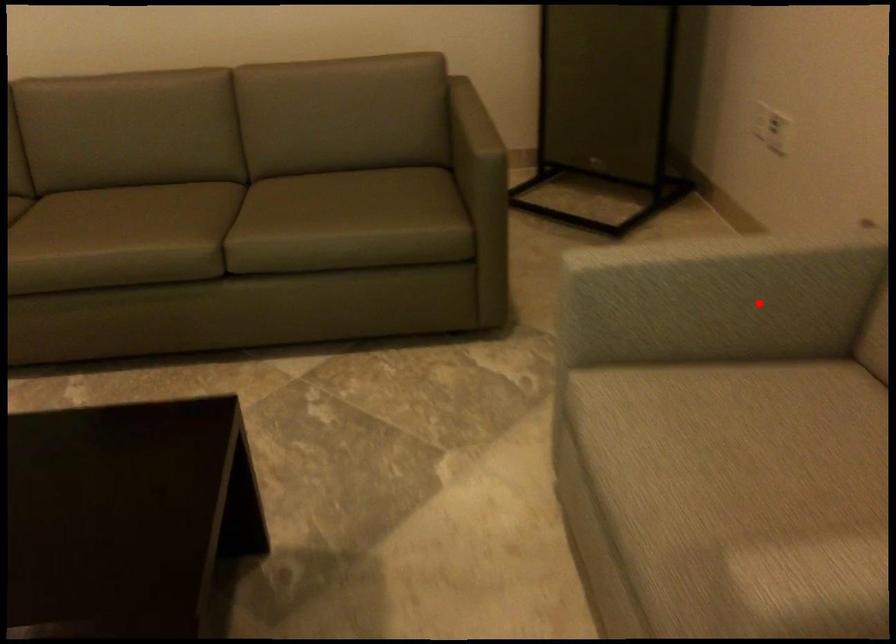
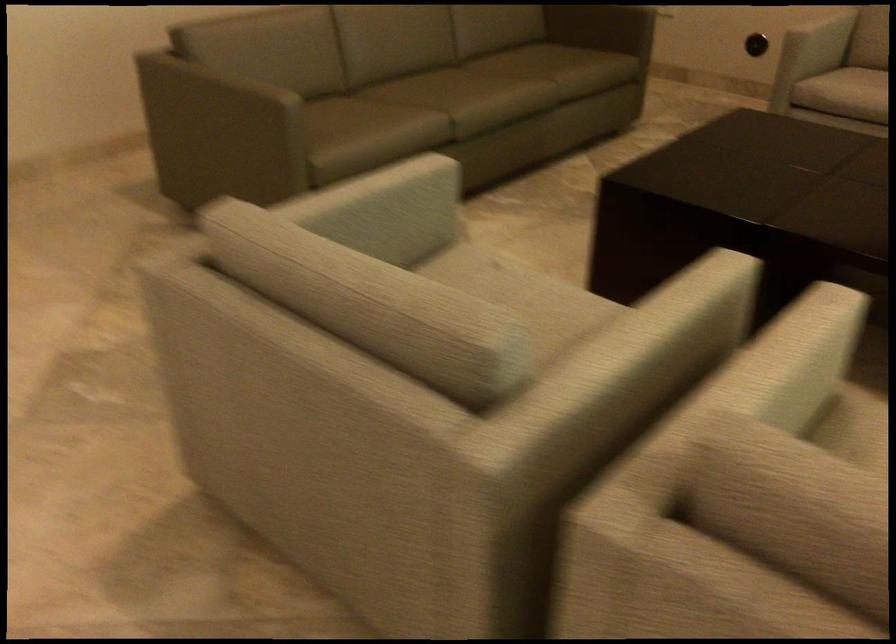
Question: I am providing you with two images of the same scene from different viewpoints. In image1, a red point is highlighted. Considering the same 3D point in image2, which of the following is correct?

Choices:
 (A) It is closer
 (B) It is farther

Answer: (B)